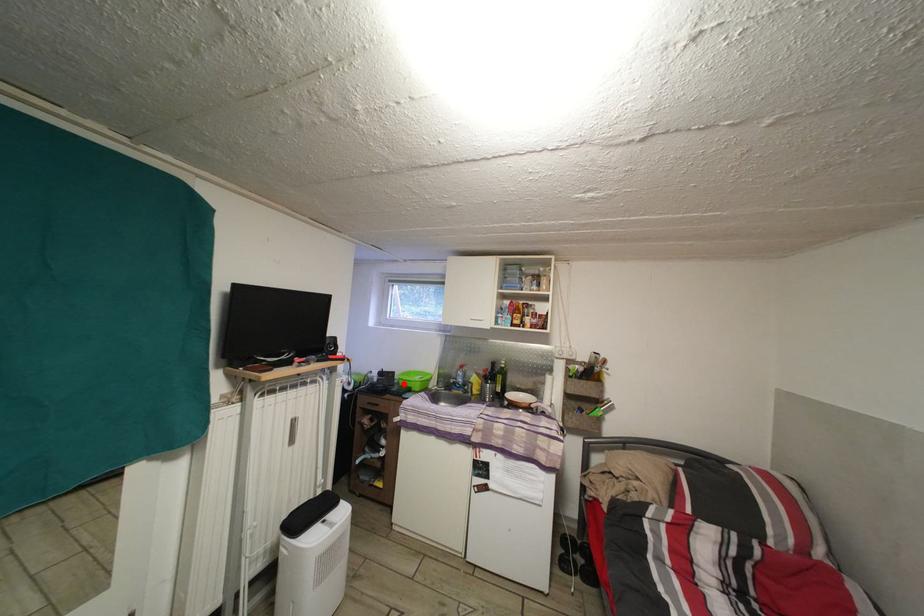
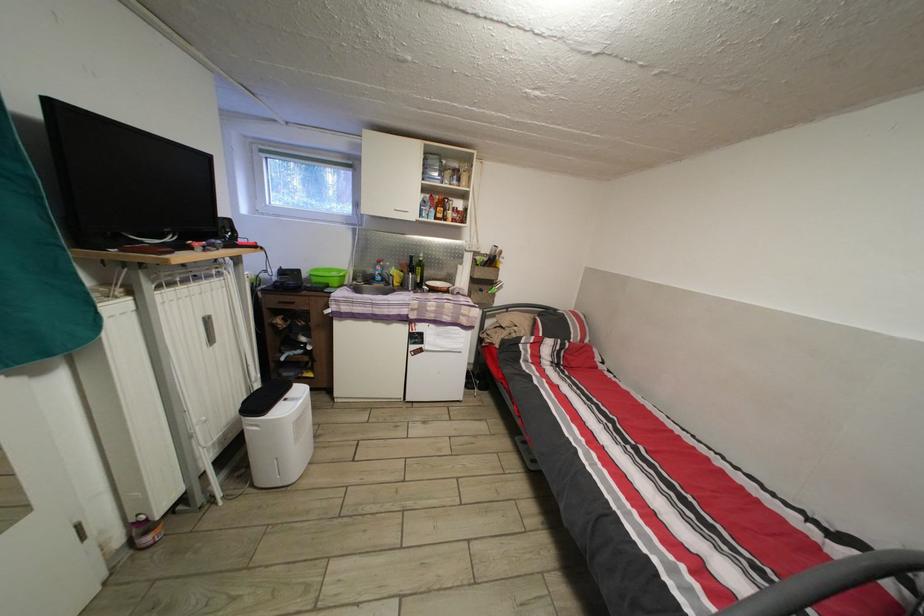
Locate, in the second image, the point that corresponds to the highlighted location in the first image.

(311, 282)